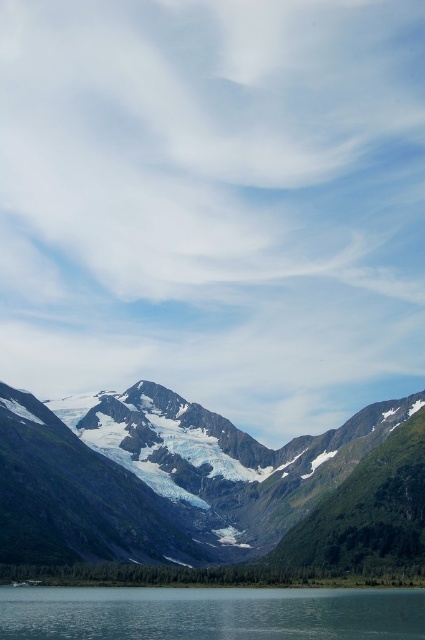
Question: Which point is farther to the camera?

Choices:
 (A) white snow-covered mountain at center
 (B) clear water at lower center

Answer: (B)

Question: Where is white snow-covered mountain at center located in relation to clear water at lower center in the image?

Choices:
 (A) below
 (B) above

Answer: (B)

Question: Does white snow-covered mountain at center lie in front of clear water at lower center?

Choices:
 (A) no
 (B) yes

Answer: (B)

Question: Can you confirm if white snow-covered mountain at center is smaller than clear water at lower center?

Choices:
 (A) no
 (B) yes

Answer: (A)